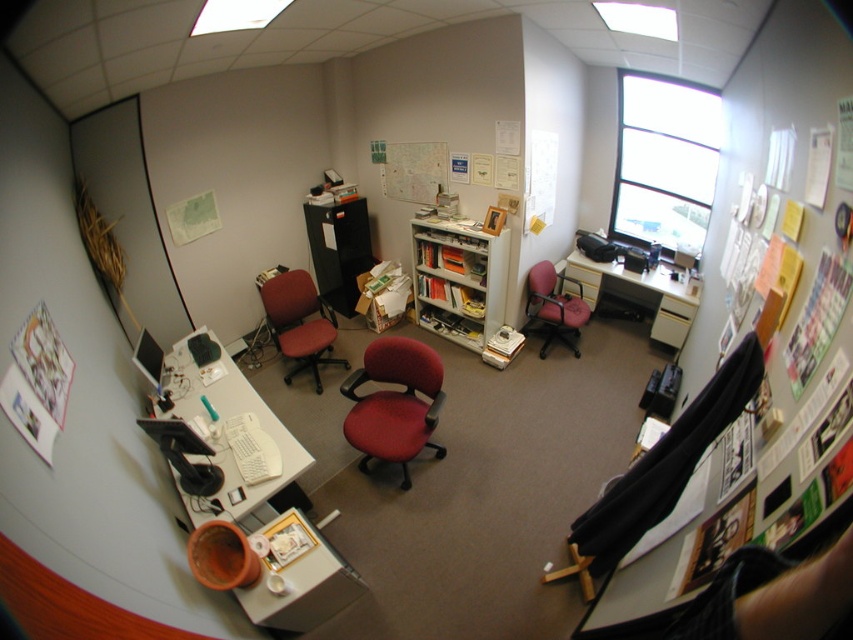
You are standing in the center of the office and want to sit down. Is the red fabric swivel chair at center within your immediate reach?

Yes, the red fabric swivel chair at center is located at point (393, 403), which is within immediate reach from the center of the office.

You are trying to decide between two chairs in the office. The red fabric swivel chair at center and the matte red office chair at center. Which one is shorter?

The red fabric swivel chair at center is shorter than the matte red office chair at center.

You are organizing the office and need to move the white glossy bookshelf at center and the matte white desk at center. Which object requires more space to move around?

The matte white desk at center requires more space to move around since it occupies more space than the white glossy bookshelf at center.